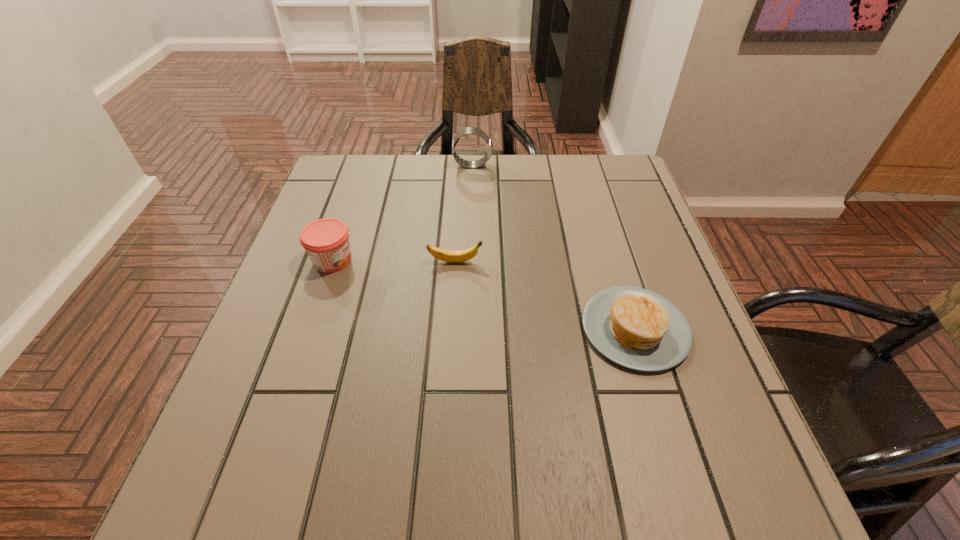
This screenshot has height=540, width=960. I want to click on watch, so click(468, 130).

Image resolution: width=960 pixels, height=540 pixels. What are the coordinates of `the tallest object` in the screenshot? It's located at (468, 130).

In order to click on jam in this screenshot , I will do `click(326, 241)`.

At what (x,y) coordinates should I click in order to perform the action: click on the third shortest object. Please return your answer as a coordinate pair (x, y). This screenshot has width=960, height=540. Looking at the image, I should click on [x=326, y=241].

Where is `banana`? The width and height of the screenshot is (960, 540). banana is located at coordinates (444, 255).

This screenshot has height=540, width=960. Identify the location of pancake. (636, 328).

The width and height of the screenshot is (960, 540). I want to click on the nearest object, so click(636, 328).

Find the location of a particular element. The height and width of the screenshot is (540, 960). vacant space positioned on the face of the watch is located at coordinates (542, 165).

At what (x,y) coordinates should I click in order to perform the action: click on vacant region located 0.220m on the front label of the leftmost object. Please return your answer as a coordinate pair (x, y). Looking at the image, I should click on (452, 260).

The image size is (960, 540). In order to click on vacant space located at the stem of the banana in this screenshot , I will do pos(592,262).